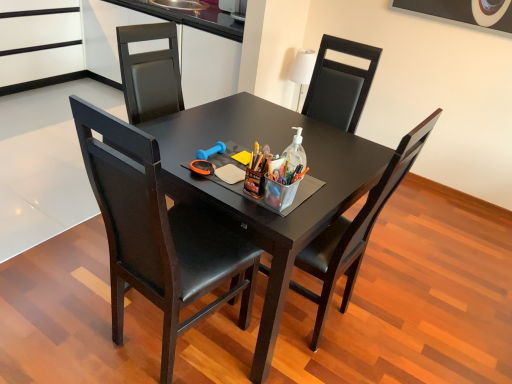
The image size is (512, 384). Find the location of `free point behind translucent plastic bottle at center`. free point behind translucent plastic bottle at center is located at coordinates (286, 144).